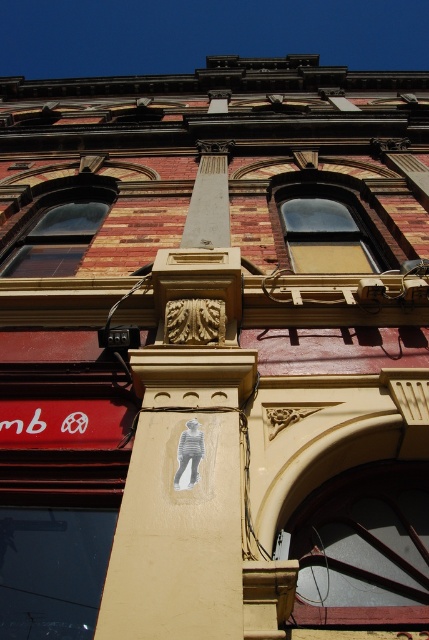
You are an architect analyzing the building facade. You notice the transparent glass window at center and the smooth concrete column at center. According to the design, which object is positioned higher up on the wall?

The smooth concrete column at center is positioned higher up on the wall than the transparent glass window at center, as the window is located below the column.